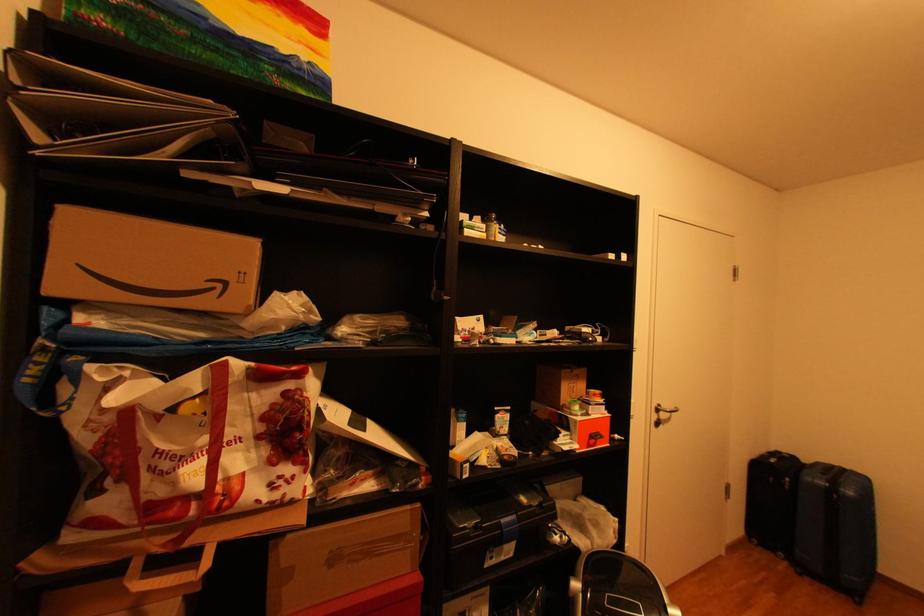
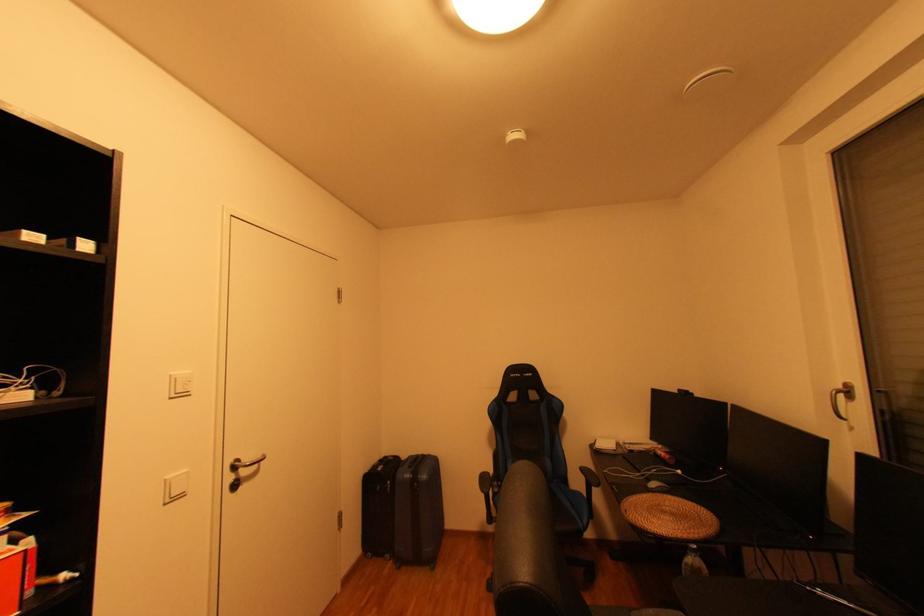
In the second image, find the point that corresponds to (x=670, y=406) in the first image.

(247, 461)